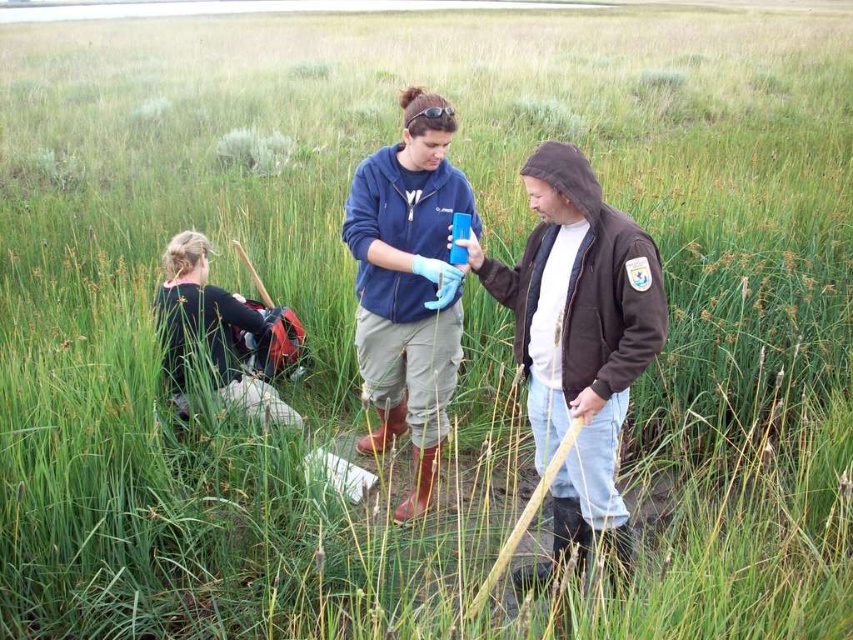
You are a researcher planning to store two jackets in a small compartment. Based on the image, which jacket between the brown leather jacket at center and the blue fabric jacket at center would be easier to fit into the compartment?

The brown leather jacket at center occupies less space than the blue fabric jacket at center, so it would be easier to fit into the small compartment.

You are a researcher in the marshy area and need to locate your brown leather jacket at center. Based on the coordinates provided, where should you look relative to the other objects in the scene?

The brown leather jacket at center is located at coordinates point (578,340), which places it centrally within the scene, likely near the middle of the image both horizontally and vertically.